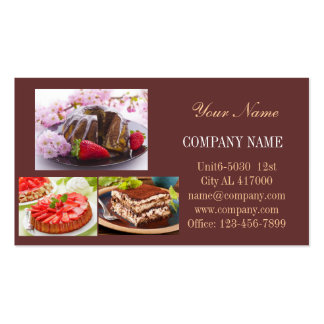
Where is `plate`? Image resolution: width=324 pixels, height=324 pixels. plate is located at coordinates (167, 228), (87, 227), (119, 157).